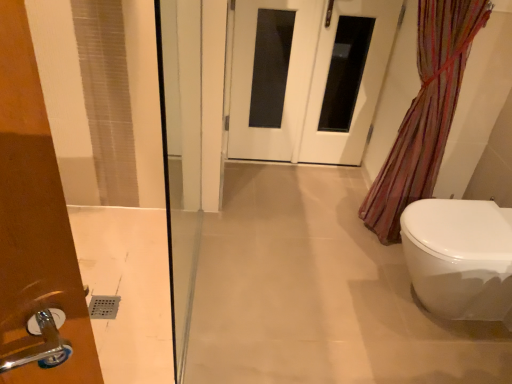
What are the coordinates of `vacant area that is in front of translucent striped fabric at right` in the screenshot? It's located at (358, 273).